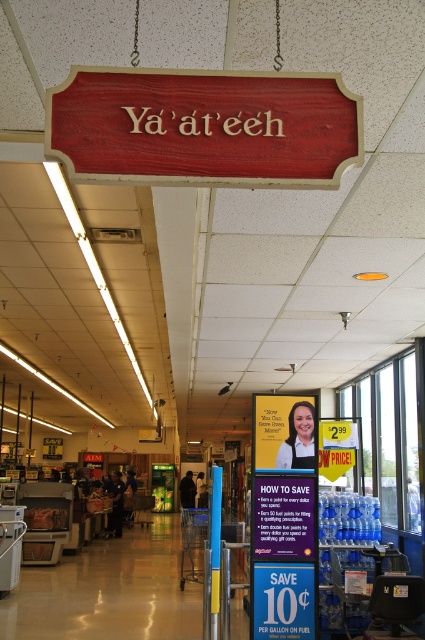
Is blue paper sign at center above yellow paper sign at center?

No, blue paper sign at center is not above yellow paper sign at center.

I want to click on blue paper sign at center, so click(x=285, y=516).

From the picture: Measure the distance between point (274, 614) and camera.

Point (274, 614) and camera are 17.74 feet apart.

Between blue plastic sign at center and yellow paper sign at center, which one has less height?

blue plastic sign at center is shorter.

What do you see at coordinates (283, 600) in the screenshot? Image resolution: width=425 pixels, height=640 pixels. I see `blue plastic sign at center` at bounding box center [283, 600].

The width and height of the screenshot is (425, 640). Identify the location of blue plastic sign at center. (283, 600).

Who is more distant from viewer, (53, 116) or (292, 547)?

The point (292, 547) is behind.

Is wooden sign at upper center thinner than blue paper sign at center?

No.

Which is in front, point (274, 80) or point (255, 538)?

Point (274, 80) is more forward.

Identify the location of wooden sign at upper center. (204, 128).